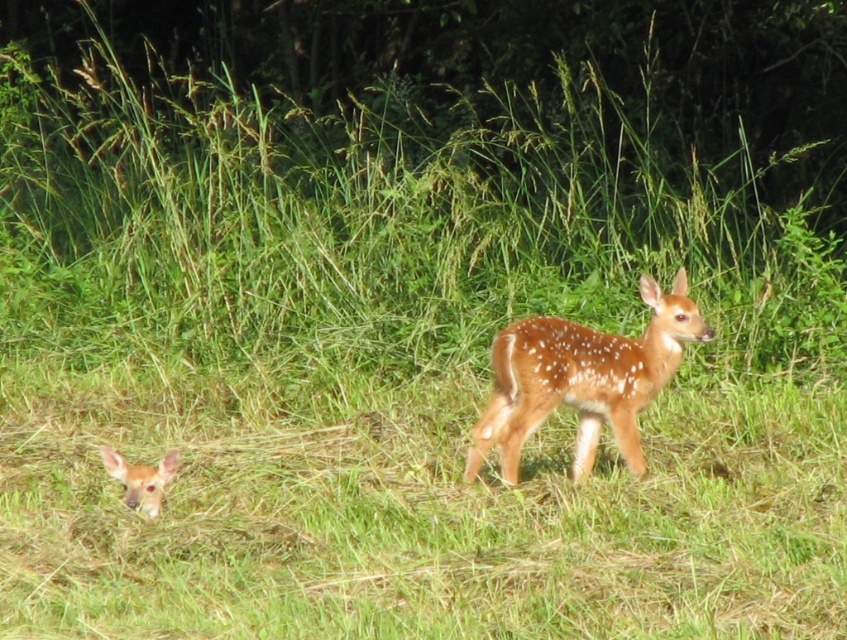
You are a photographer trying to capture both deer in a single shot. You notice two points marked in the image. The first point, point (645, 280), is closer to you than the second point, point (133, 490). If you want to ensure both deer are in focus, which point should you focus on?

You should focus on point (645, 280) because it is closer to you than point (133, 490). This ensures that the deer in the foreground will be in focus, and the background deer may still be sharp due to depth of field.

You are a wildlife photographer trying to capture a photo of both spotted fur deer at center and spotted fur deer at lower left. Based on their positions, which deer is positioned closer to the camera?

The spotted fur deer at lower left is closer to the camera because it is positioned at the lower left, which is typically closer in such scenes compared to the deer at center.

You are a wildlife photographer trying to capture both spotted fur deer at center and spotted fur deer at lower left in the same frame. Based on their positions, which deer is positioned to the right of the other?

The spotted fur deer at center is positioned to the right of the spotted fur deer at lower left.